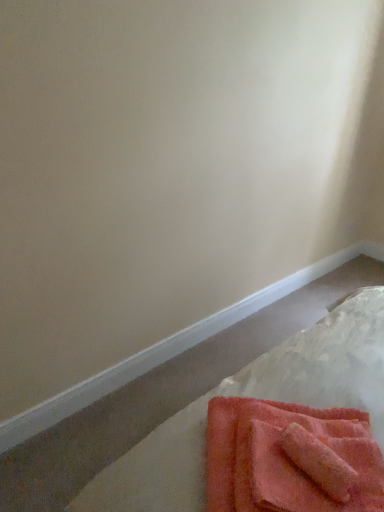
You are a GUI agent. You are given a task and a screenshot of the screen. Output one action in this format:
    pyautogui.click(x=<x>, y=<y>)
    Task: Click on the fluffy coral towel at lower right
    This screenshot has width=384, height=512.
    Given the screenshot: What is the action you would take?
    pyautogui.click(x=288, y=458)

What do you see at coordinates (288, 458) in the screenshot? I see `fluffy coral towel at lower right` at bounding box center [288, 458].

I want to click on fluffy coral towel at lower right, so click(x=288, y=458).